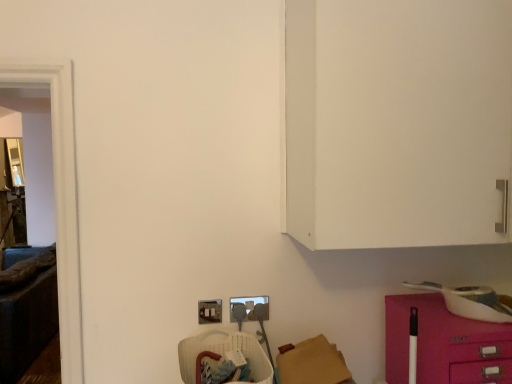
You are a GUI agent. You are given a task and a screenshot of the screen. Output one action in this format:
    pyautogui.click(x=<x>, y=<y>)
    Task: Click on the transparent glass door at left
    The width and height of the screenshot is (512, 384).
    Given the screenshot: What is the action you would take?
    pyautogui.click(x=60, y=198)

What is the approximate width of metallic silver electric outlet at lower center, arranged as the 1th electric outlet when viewed from the left?

0.68 inches.

In order to face translucent plastic basket at lower center, should I rotate leftwards or rightwards?

A 4.599 degree turn to the left will do.

Identify the location of pink glossy drawer at lower right. This screenshot has height=384, width=512. (444, 344).

Locate an element on the screen. transparent glass door at left is located at coordinates (60, 198).

Considering the positions of objects matte gray plug at lower center, which is the second electric outlet in left-to-right order, and translucent plastic basket at lower center in the image provided, who is more to the right, matte gray plug at lower center, which is the second electric outlet in left-to-right order, or translucent plastic basket at lower center?

From the viewer's perspective, matte gray plug at lower center, which is the second electric outlet in left-to-right order, appears more on the right side.

Would you say translucent plastic basket at lower center is part of matte gray plug at lower center, which is the second electric outlet in left-to-right order,'s contents?

No, translucent plastic basket at lower center is not a part of matte gray plug at lower center, which is the second electric outlet in left-to-right order.

From the image's perspective, is matte gray plug at lower center, positioned as the first electric outlet in right-to-left order, located above or below translucent plastic basket at lower center?

matte gray plug at lower center, positioned as the first electric outlet in right-to-left order, is situated higher than translucent plastic basket at lower center in the image.

Considering the points (254, 299) and (199, 347), which point is behind, point (254, 299) or point (199, 347)?

The point (254, 299) is farther.

In terms of height, does transparent glass door at left look taller or shorter compared to matte gray plug at lower center, positioned as the first electric outlet in right-to-left order?

In the image, transparent glass door at left appears to be taller than matte gray plug at lower center, positioned as the first electric outlet in right-to-left order.

Image resolution: width=512 pixels, height=384 pixels. I want to click on electric outlet that is the 2nd object directly below the transparent glass door at left (from a real-world perspective), so click(x=249, y=304).

Looking at this image, is transparent glass door at left turned away from matte gray plug at lower center, positioned as the first electric outlet in right-to-left order?

No, matte gray plug at lower center, positioned as the first electric outlet in right-to-left order, is not at the back of transparent glass door at left.

Is transparent glass door at left surrounding matte gray plug at lower center, positioned as the first electric outlet in right-to-left order?

No, matte gray plug at lower center, positioned as the first electric outlet in right-to-left order, is not surrounded by transparent glass door at left.

Is metallic silver electric outlet at lower center, which is the 2th electric outlet from right to left, positioned beyond the bounds of pink glossy drawer at lower right?

metallic silver electric outlet at lower center, which is the 2th electric outlet from right to left, is positioned outside pink glossy drawer at lower right.

Is metallic silver electric outlet at lower center, arranged as the 1th electric outlet when viewed from the left, directly adjacent to pink glossy drawer at lower right?

They are not placed beside each other.

Which object is wider, metallic silver electric outlet at lower center, arranged as the 1th electric outlet when viewed from the left, or pink glossy drawer at lower right?

pink glossy drawer at lower right is wider.

Is metallic silver electric outlet at lower center, which is the 2th electric outlet from right to left, to the left or to the right of pink glossy drawer at lower right in the image?

From the image, it's evident that metallic silver electric outlet at lower center, which is the 2th electric outlet from right to left, is to the left of pink glossy drawer at lower right.

Can you confirm if metallic silver electric outlet at lower center, which is the 2th electric outlet from right to left, is taller than matte gray plug at lower center, which is the second electric outlet in left-to-right order?

In fact, metallic silver electric outlet at lower center, which is the 2th electric outlet from right to left, may be shorter than matte gray plug at lower center, which is the second electric outlet in left-to-right order.

In the image, there is a metallic silver electric outlet at lower center, which is the 2th electric outlet from right to left. Identify the location of electric outlet below it (from a real-world perspective). This screenshot has height=384, width=512. (249, 304).

Considering the relative sizes of metallic silver electric outlet at lower center, which is the 2th electric outlet from right to left, and matte gray plug at lower center, positioned as the first electric outlet in right-to-left order, in the image provided, is metallic silver electric outlet at lower center, which is the 2th electric outlet from right to left, bigger than matte gray plug at lower center, positioned as the first electric outlet in right-to-left order,?

No, metallic silver electric outlet at lower center, which is the 2th electric outlet from right to left, is not bigger than matte gray plug at lower center, positioned as the first electric outlet in right-to-left order.

Considering the sizes of metallic silver electric outlet at lower center, which is the 2th electric outlet from right to left, and matte gray plug at lower center, positioned as the first electric outlet in right-to-left order, in the image, is metallic silver electric outlet at lower center, which is the 2th electric outlet from right to left, wider or thinner than matte gray plug at lower center, positioned as the first electric outlet in right-to-left order,?

metallic silver electric outlet at lower center, which is the 2th electric outlet from right to left, is wider than matte gray plug at lower center, positioned as the first electric outlet in right-to-left order.

Considering the positions of objects matte gray plug at lower center, positioned as the first electric outlet in right-to-left order, and transparent glass door at left in the image provided, who is behind, matte gray plug at lower center, positioned as the first electric outlet in right-to-left order, or transparent glass door at left?

matte gray plug at lower center, positioned as the first electric outlet in right-to-left order.

Considering the relative sizes of matte gray plug at lower center, positioned as the first electric outlet in right-to-left order, and transparent glass door at left in the image provided, is matte gray plug at lower center, positioned as the first electric outlet in right-to-left order, bigger than transparent glass door at left?

No.

Are matte gray plug at lower center, which is the second electric outlet in left-to-right order, and transparent glass door at left located far from each other?

matte gray plug at lower center, which is the second electric outlet in left-to-right order, is near transparent glass door at left, not far away.

At what (x,y) coordinates should I click in order to perform the action: click on glass door that is on the left side of pink glossy drawer at lower right. Please return your answer as a coordinate pair (x, y). The height and width of the screenshot is (384, 512). Looking at the image, I should click on (60, 198).

Which is in front, point (69, 183) or point (442, 367)?

Point (442, 367)

Which object is positioned more to the right, transparent glass door at left or pink glossy drawer at lower right?

Positioned to the right is pink glossy drawer at lower right.

Consider the image. From a real-world perspective, who is located lower, pink glossy drawer at lower right or translucent plastic basket at lower center?

From a 3D spatial view, translucent plastic basket at lower center is below.

Are pink glossy drawer at lower right and translucent plastic basket at lower center far apart?

Actually, pink glossy drawer at lower right and translucent plastic basket at lower center are a little close together.

Is the position of pink glossy drawer at lower right less distant than that of translucent plastic basket at lower center?

No, pink glossy drawer at lower right is further to the viewer.

From the image's perspective, relative to translucent plastic basket at lower center, is pink glossy drawer at lower right above or below?

pink glossy drawer at lower right is above translucent plastic basket at lower center.

The image size is (512, 384). In the image, there is a matte gray plug at lower center, which is the second electric outlet in left-to-right order. What are the coordinates of `armchair below it (from a real-world perspective)` in the screenshot? It's located at (223, 353).

The image size is (512, 384). Find the location of `the 1st electric outlet below when counting from the transparent glass door at left (from the image's perspective)`. the 1st electric outlet below when counting from the transparent glass door at left (from the image's perspective) is located at coordinates pyautogui.click(x=249, y=304).

Looking at the image, which one is located further to pink glossy drawer at lower right, transparent glass door at left or metallic silver electric outlet at lower center, arranged as the 1th electric outlet when viewed from the left?

transparent glass door at left lies further to pink glossy drawer at lower right than the other object.

Based on their spatial positions, is translucent plastic basket at lower center or metallic silver electric outlet at lower center, arranged as the 1th electric outlet when viewed from the left, further from matte gray plug at lower center, positioned as the first electric outlet in right-to-left order?

The object further to matte gray plug at lower center, positioned as the first electric outlet in right-to-left order, is translucent plastic basket at lower center.

Considering their positions, is pink glossy drawer at lower right positioned closer to matte gray plug at lower center, which is the second electric outlet in left-to-right order, than metallic silver electric outlet at lower center, arranged as the 1th electric outlet when viewed from the left?

metallic silver electric outlet at lower center, arranged as the 1th electric outlet when viewed from the left.

From the image, which object appears to be farther from pink glossy drawer at lower right, translucent plastic basket at lower center or matte gray plug at lower center, positioned as the first electric outlet in right-to-left order?

matte gray plug at lower center, positioned as the first electric outlet in right-to-left order.

In the scene shown: Based on their spatial positions, is pink glossy drawer at lower right or translucent plastic basket at lower center closer to metallic silver electric outlet at lower center, arranged as the 1th electric outlet when viewed from the left?

The object closer to metallic silver electric outlet at lower center, arranged as the 1th electric outlet when viewed from the left, is translucent plastic basket at lower center.

When comparing their distances from transparent glass door at left, does metallic silver electric outlet at lower center, arranged as the 1th electric outlet when viewed from the left, or pink glossy drawer at lower right seem further?

Among the two, pink glossy drawer at lower right is located further to transparent glass door at left.

Which object lies nearer to the anchor point pink glossy drawer at lower right, translucent plastic basket at lower center or transparent glass door at left?

translucent plastic basket at lower center is positioned closer to the anchor pink glossy drawer at lower right.

From the image, which object appears to be nearer to matte gray plug at lower center, which is the second electric outlet in left-to-right order, translucent plastic basket at lower center or pink glossy drawer at lower right?

translucent plastic basket at lower center lies closer to matte gray plug at lower center, which is the second electric outlet in left-to-right order, than the other object.

The width and height of the screenshot is (512, 384). I want to click on electric outlet located between translucent plastic basket at lower center and pink glossy drawer at lower right in the left-right direction, so click(249, 304).

The height and width of the screenshot is (384, 512). I want to click on armchair between transparent glass door at left and pink glossy drawer at lower right, so click(x=223, y=353).

You are a GUI agent. You are given a task and a screenshot of the screen. Output one action in this format:
    pyautogui.click(x=<x>, y=<y>)
    Task: Click on the armchair between transparent glass door at left and matte gray plug at lower center, positioned as the first electric outlet in right-to-left order, from left to right
    
    Given the screenshot: What is the action you would take?
    pyautogui.click(x=223, y=353)

Where is `electric outlet located between translucent plastic basket at lower center and matte gray plug at lower center, positioned as the first electric outlet in right-to-left order, in the depth direction`? The width and height of the screenshot is (512, 384). electric outlet located between translucent plastic basket at lower center and matte gray plug at lower center, positioned as the first electric outlet in right-to-left order, in the depth direction is located at coordinates (210, 311).